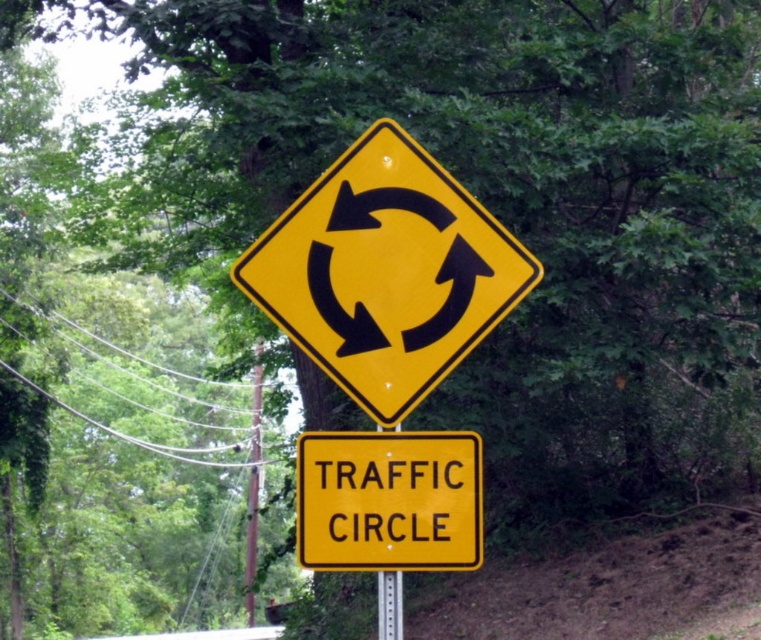
Question: Is yellow reflective diamond at center positioned before brown wooden pole at center?

Choices:
 (A) yes
 (B) no

Answer: (A)

Question: Which of the following is the farthest from the observer?

Choices:
 (A) brown wooden pole at center
 (B) metallic silver pole at center
 (C) yellow reflective diamond at center
 (D) yellow/yellowish metal/texture traffic circle at center

Answer: (A)

Question: Which of the following is the closest to the observer?

Choices:
 (A) (x=365, y=214)
 (B) (x=253, y=392)
 (C) (x=408, y=563)

Answer: (A)

Question: Can you confirm if yellow/yellowish metal/texture traffic circle at center is positioned to the left of brown wooden pole at center?

Choices:
 (A) yes
 (B) no

Answer: (B)

Question: Does yellow/yellowish metal/texture traffic circle at center appear on the right side of metallic silver pole at center?

Choices:
 (A) no
 (B) yes

Answer: (A)

Question: Considering the real-world distances, which object is closest to the metallic silver pole at center?

Choices:
 (A) brown wooden pole at center
 (B) yellow/yellowish metal/texture traffic circle at center

Answer: (B)